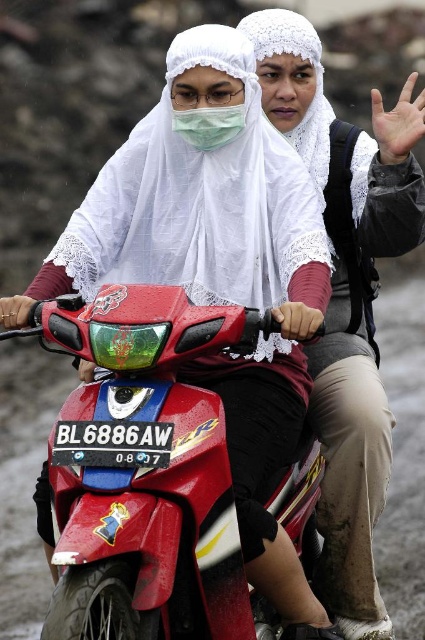
You are a fashion designer analyzing the image. You need to determine which item is wider between the white lace hijab at center and the green matte mask at center. Which one is wider?

The white lace hijab at center is wider than the green matte mask at center according to the description.

You are a delivery person who needs to park the shiny red motorcycle at center in a parking spot located at coordinates 0.738, 0.344. Is the motorcycle already positioned correctly?

Yes, the shiny red motorcycle at center is already positioned at point (146, 472), so it is correctly parked in the parking spot.

From the picture: You are standing in front of the Honda scooter in the muddy environment. There are two points marked on the scooter. Which point, point 1 at coordinates (x=164, y=531) or point 2 at coordinates (x=328, y=545), is closer to you?

Point 1 at coordinates (x=164, y=531) is closer to you because it is closer to the camera than point 2 at coordinates (x=328, y=545).